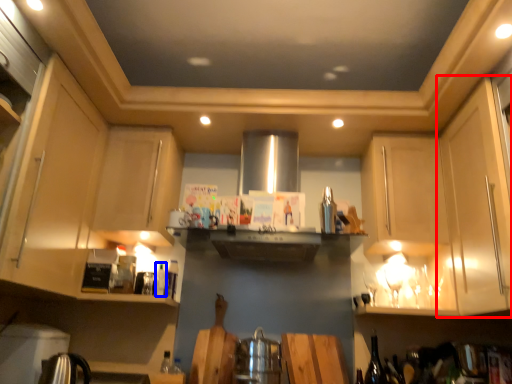
Question: Which object appears farthest to the camera in this image, cabinetry (highlighted by a red box) or bottle (highlighted by a blue box)?

Choices:
 (A) cabinetry
 (B) bottle

Answer: (B)